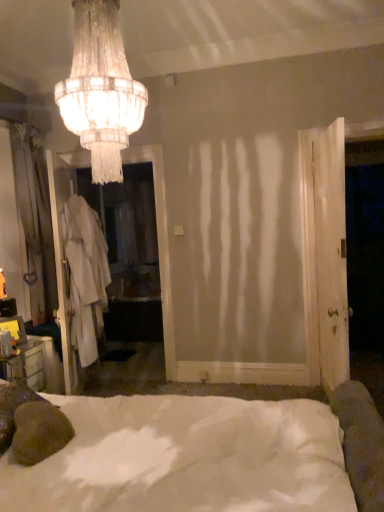
Question: Is white wood door at right taller than white fabric robe at left?

Choices:
 (A) no
 (B) yes

Answer: (B)

Question: Considering the relative sizes of white wood door at right and white fabric robe at left in the image provided, is white wood door at right thinner than white fabric robe at left?

Choices:
 (A) yes
 (B) no

Answer: (A)

Question: Does white wood door at right contain white fabric robe at left?

Choices:
 (A) yes
 (B) no

Answer: (B)

Question: Does white wood door at right have a lesser height compared to white fabric robe at left?

Choices:
 (A) no
 (B) yes

Answer: (A)

Question: Is white wood door at right wider than white fabric robe at left?

Choices:
 (A) yes
 (B) no

Answer: (B)

Question: Is white soft bed at center bigger or smaller than crystal glass chandelier at upper center?

Choices:
 (A) big
 (B) small

Answer: (A)

Question: Is white soft bed at center in front of or behind crystal glass chandelier at upper center in the image?

Choices:
 (A) front
 (B) behind

Answer: (A)

Question: From the image's perspective, is white soft bed at center positioned above or below crystal glass chandelier at upper center?

Choices:
 (A) below
 (B) above

Answer: (A)

Question: Is point (253, 406) positioned closer to the camera than point (86, 46)?

Choices:
 (A) farther
 (B) closer

Answer: (A)

Question: Looking at their shapes, would you say white fabric robe at left is wider or thinner than white fabric screen door at left?

Choices:
 (A) thin
 (B) wide

Answer: (B)

Question: Relative to white fabric screen door at left, is white fabric robe at left in front or behind?

Choices:
 (A) behind
 (B) front

Answer: (B)

Question: From the image's perspective, is white fabric robe at left located above or below white fabric screen door at left?

Choices:
 (A) above
 (B) below

Answer: (B)

Question: Considering the positions of point (92, 348) and point (160, 288), is point (92, 348) closer or farther from the camera than point (160, 288)?

Choices:
 (A) closer
 (B) farther

Answer: (A)

Question: Looking at their shapes, would you say white fabric screen door at left is wider or thinner than white soft bed at center?

Choices:
 (A) wide
 (B) thin

Answer: (B)

Question: From their relative heights in the image, would you say white fabric screen door at left is taller or shorter than white soft bed at center?

Choices:
 (A) short
 (B) tall

Answer: (B)